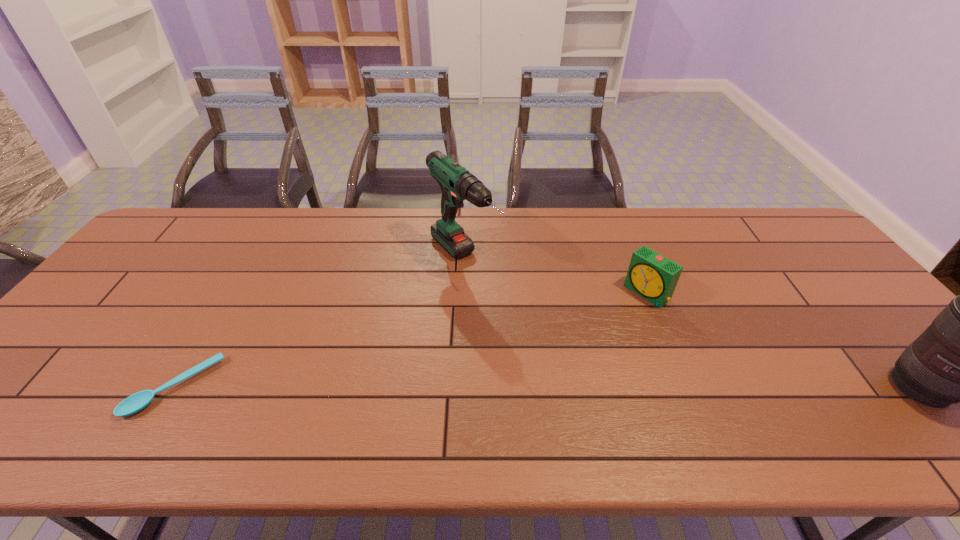
Where is `vacant area that lies between the alarm clock and the leftmost object`? The height and width of the screenshot is (540, 960). vacant area that lies between the alarm clock and the leftmost object is located at coordinates (411, 340).

Find the location of a particular element. Image resolution: width=960 pixels, height=540 pixels. free point between the spoon and the second shortest object is located at coordinates (411, 340).

At what (x,y) coordinates should I click in order to perform the action: click on free space between the drill and the third object from left to right. Please return your answer as a coordinate pair (x, y). Image resolution: width=960 pixels, height=540 pixels. Looking at the image, I should click on (556, 276).

Locate which object is the third closest to the spoon. Please provide its 2D coordinates. Your answer should be formatted as a tuple, i.e. [(x, y)], where the tuple contains the x and y coordinates of a point satisfying the conditions above.

[(959, 358)]

Identify which object is the second closest to the third shortest object. Please provide its 2D coordinates. Your answer should be formatted as a tuple, i.e. [(x, y)], where the tuple contains the x and y coordinates of a point satisfying the conditions above.

[(457, 184)]

Identify the location of blank area in the image that satisfies the following two spatial constraints: 1. on the back side of the third object from right to left; 2. on the left side of the shortest object. The image size is (960, 540). (252, 260).